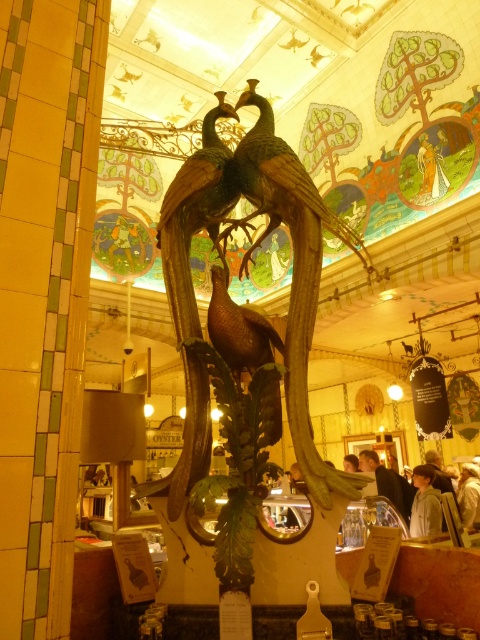
You are a guest in this historic establishment and want to take a photo of the bronze sculpture of two peacocks. Which peacock, the wooden peacock at center or the shiny metallic peacock at center, will appear larger in your photo?

The wooden peacock at center will appear larger in your photo because it is closer to the viewer than the shiny metallic peacock at center.

Consider the image. You are standing in the ornate interior space and want to locate the shiny gold peacock at center. Which object is the point at coordinate point (202, 182) on?

The point at coordinate point (202, 182) is on the shiny gold peacock at center.